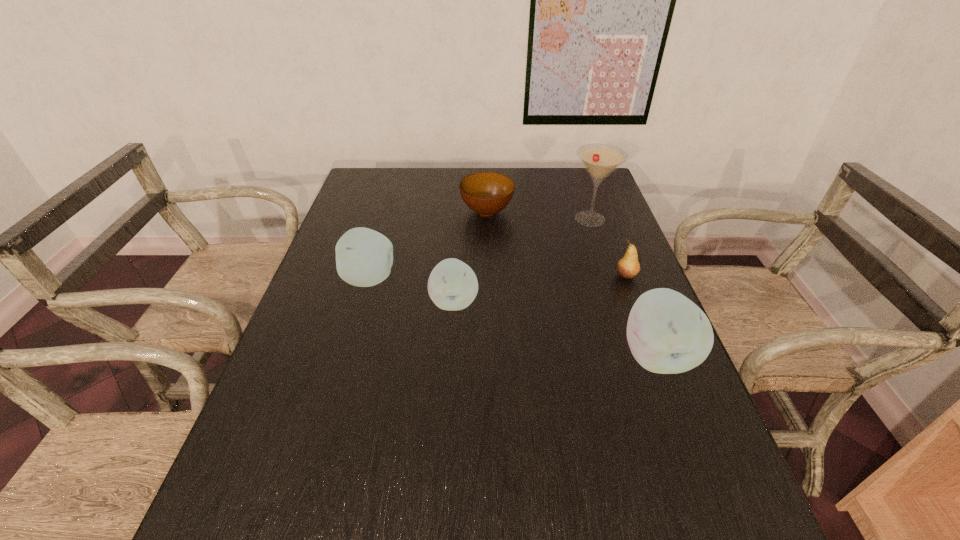
In order to click on free spot that satisfies the following two spatial constraints: 1. on the back side of the pear; 2. on the right side of the leftmost object in this screenshot , I will do click(x=371, y=276).

Locate an element on the screen. free space that satisfies the following two spatial constraints: 1. on the front side of the pear; 2. on the left side of the martini is located at coordinates (609, 276).